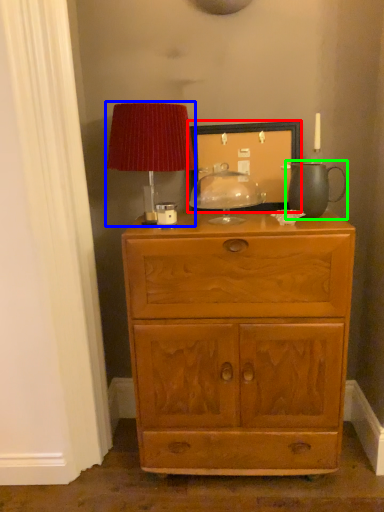
Question: Considering the real-world distances, which object is closest to picture frame (highlighted by a red box)? table lamp (highlighted by a blue box) or tea pot (highlighted by a green box).

Choices:
 (A) table lamp
 (B) tea pot

Answer: (B)